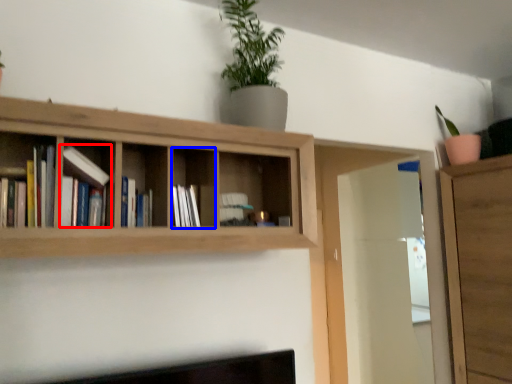
Question: Which of the following is the closest to the observer, book (highlighted by a red box) or cabinet (highlighted by a blue box)?

Choices:
 (A) book
 (B) cabinet

Answer: (A)